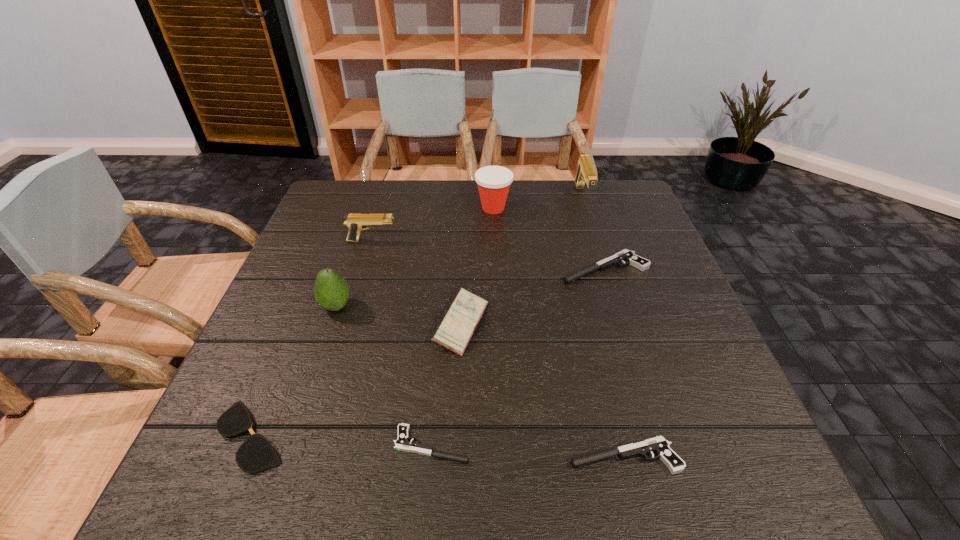
Identify the location of empty space between the bigger tan pistol and the nearer tan pistol. (477, 219).

Find the location of a particular element. unoccupied position between the pink diary and the red-orange Dixie cup is located at coordinates (477, 266).

What are the coordinates of `vacant area between the second farthest pistol and the spectacles` in the screenshot? It's located at (312, 338).

Find the location of a particular element. The width and height of the screenshot is (960, 540). object that is the fourth closest one to the avocado is located at coordinates (402, 443).

Locate an element on the screen. This screenshot has height=540, width=960. object that is the fifth nearest to the right tan pistol is located at coordinates (331, 291).

Identify which pistol is located as the third nearest to the shortest object. Please provide its 2D coordinates. Your answer should be formatted as a tuple, i.e. [(x, y)], where the tuple contains the x and y coordinates of a point satisfying the conditions above.

[(355, 222)]

Select which pistol appears as the fourth closest to the sixth shortest object. Please provide its 2D coordinates. Your answer should be formatted as a tuple, i.e. [(x, y)], where the tuple contains the x and y coordinates of a point satisfying the conditions above.

[(659, 445)]

At what (x,y) coordinates should I click in order to perform the action: click on black pistol that is the third closest to the avocado. Please return your answer as a coordinate pair (x, y). The height and width of the screenshot is (540, 960). Looking at the image, I should click on (659, 445).

Select which black pistol is the closest to the red-orange Dixie cup. Please provide its 2D coordinates. Your answer should be formatted as a tuple, i.e. [(x, y)], where the tuple contains the x and y coordinates of a point satisfying the conditions above.

[(629, 257)]

The width and height of the screenshot is (960, 540). Find the location of `blank space that satisfies the following two spatial constraints: 1. at the barrel of the third farthest object; 2. on the front side of the spectacles`. blank space that satisfies the following two spatial constraints: 1. at the barrel of the third farthest object; 2. on the front side of the spectacles is located at coordinates (314, 436).